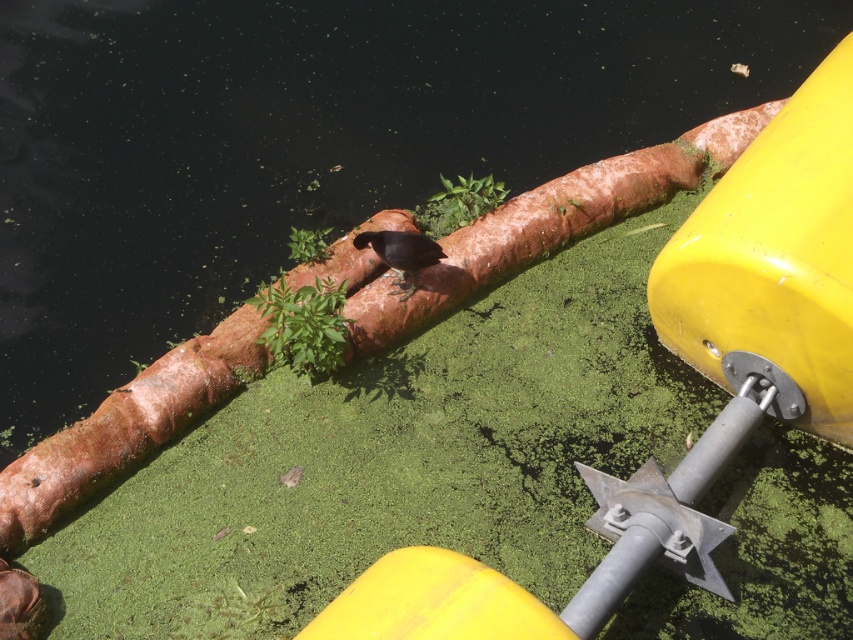
Does point (547, 132) come closer to viewer compared to point (421, 268)?

No.

Looking at this image, does green algae water at center appear over shiny black bird at center?

Yes, green algae water at center is above shiny black bird at center.

Between point (78, 72) and point (426, 256), which one is positioned behind?

Positioned behind is point (78, 72).

I want to click on green algae water at center, so click(305, 144).

Between green algae water at center and green mossy algae at center, which one appears on the right side from the viewer's perspective?

Positioned to the right is green algae water at center.

At what (x,y) coordinates should I click in order to perform the action: click on green algae water at center. Please return your answer as a coordinate pair (x, y). This screenshot has width=853, height=640. Looking at the image, I should click on (305, 144).

Does point (419, 209) come closer to viewer compared to point (399, 248)?

No, (419, 209) is further to viewer.

Between point (459, 193) and point (422, 256), which one is positioned in front?

Point (422, 256) is more forward.

I want to click on green mossy algae at center, so click(x=457, y=204).

Find the location of a particular element. The height and width of the screenshot is (640, 853). green mossy algae at center is located at coordinates (457, 204).